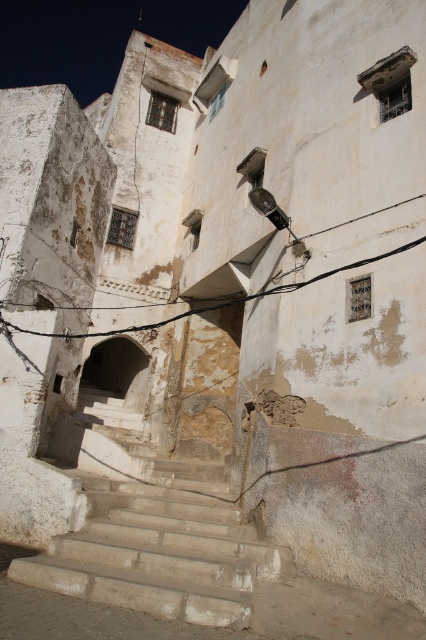
Can you confirm if smooth concrete stairs at center is positioned to the right of black wire at upper center?

No, smooth concrete stairs at center is not to the right of black wire at upper center.

Consider the image. Does smooth concrete stairs at center have a smaller size compared to black wire at upper center?

Yes, smooth concrete stairs at center is smaller than black wire at upper center.

Is point (121, 604) behind point (422, 195)?

No, (121, 604) is in front of (422, 195).

You are a GUI agent. You are given a task and a screenshot of the screen. Output one action in this format:
    pyautogui.click(x=<x>, y=<y>)
    Task: Click on the smooth concrete stairs at center
    
    Given the screenshot: What is the action you would take?
    pyautogui.click(x=158, y=541)